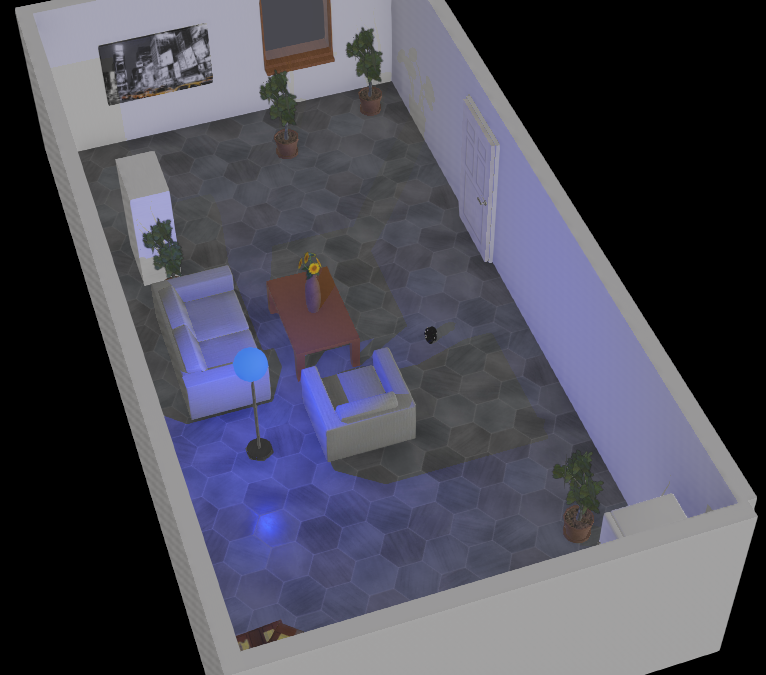
Locate an element on the screen. vase is located at coordinates (313, 293).